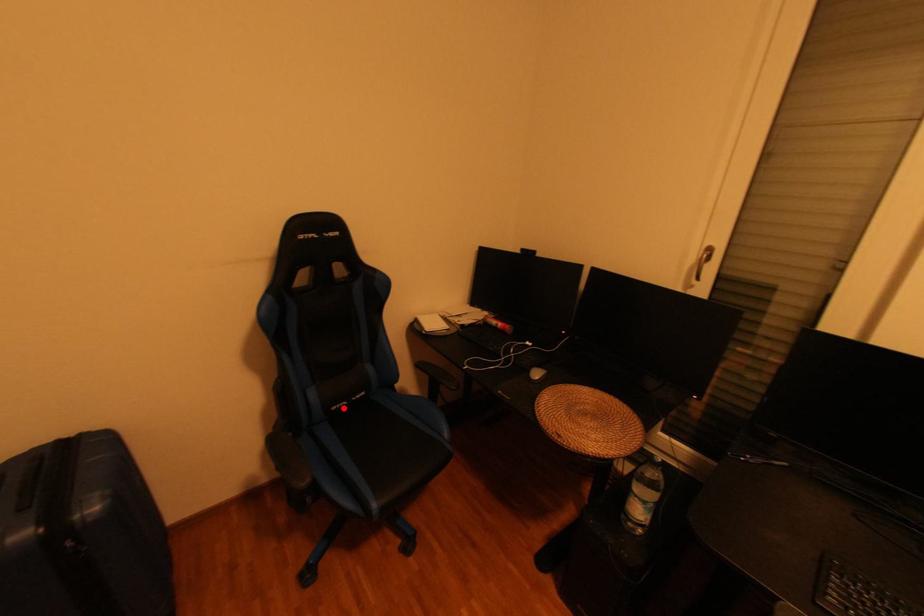
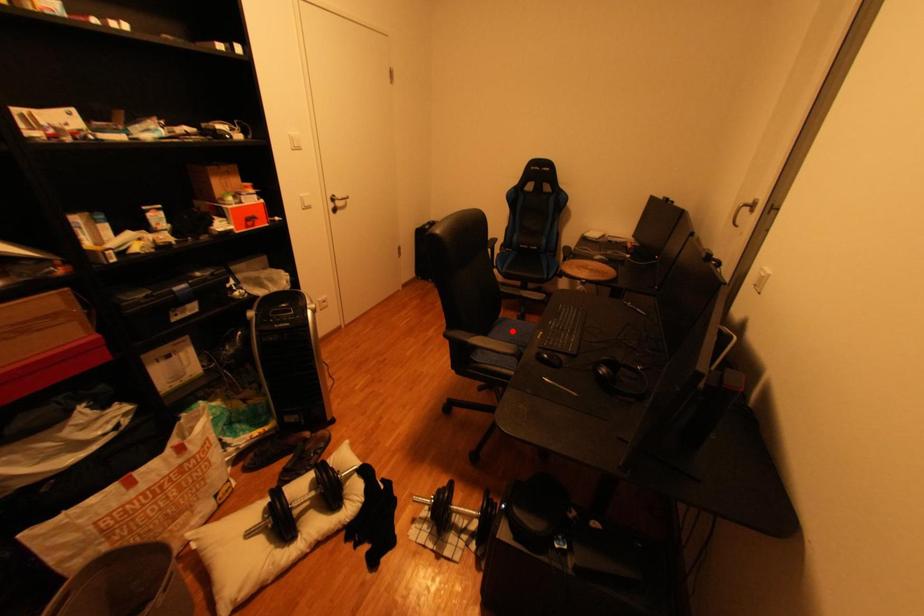
Consider the image. I am providing you with two images of the same scene from different viewpoints. A red point is marked on the first image and another point is marked on the second image. Is the red point in image1 aligned with the point shown in image2?

No